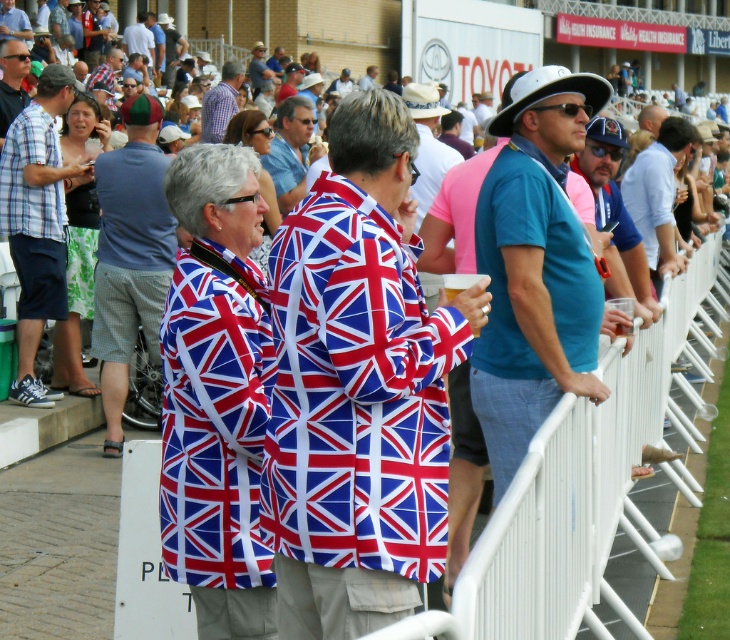
Who is higher up, union jack shirt at center or union jack-patterned shirt at center?

Positioned higher is union jack shirt at center.

Can you confirm if union jack shirt at center is bigger than union jack-patterned shirt at center?

Yes.

This screenshot has height=640, width=730. Identify the location of union jack shirt at center. (358, 387).